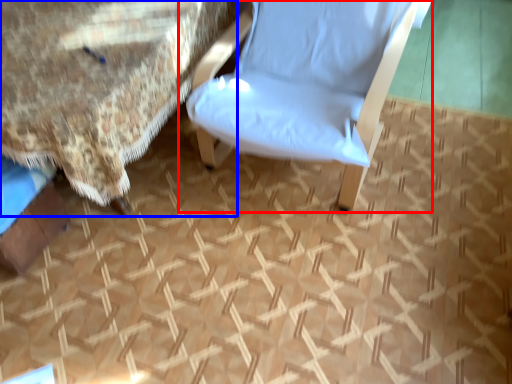
Question: Among these objects, which one is farthest to the camera, chair (highlighted by a red box) or bed (highlighted by a blue box)?

Choices:
 (A) chair
 (B) bed

Answer: (B)